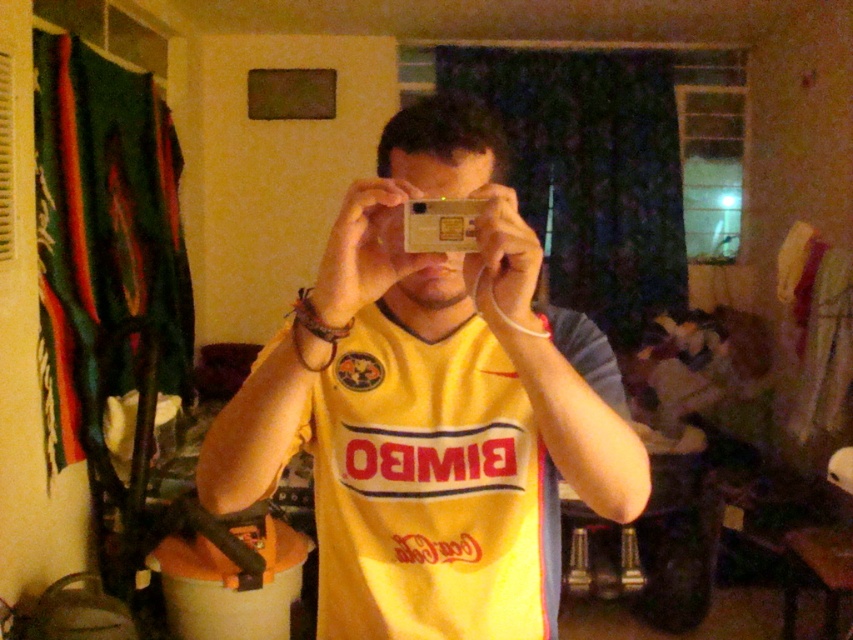
Question: Which object appears closest to the camera in this image?

Choices:
 (A) yellow jersey at center
 (B) metallic gold card at center

Answer: (A)

Question: Can you confirm if yellow jersey at center is positioned to the right of metallic gold card at center?

Choices:
 (A) no
 (B) yes

Answer: (A)

Question: Which of the following is the closest to the observer?

Choices:
 (A) yellow jersey at center
 (B) metallic gold card at center

Answer: (A)

Question: Does yellow jersey at center have a lesser width compared to metallic gold card at center?

Choices:
 (A) yes
 (B) no

Answer: (B)

Question: Is yellow jersey at center to the left of metallic gold card at center from the viewer's perspective?

Choices:
 (A) yes
 (B) no

Answer: (A)

Question: Which object is farther from the camera taking this photo?

Choices:
 (A) yellow jersey at center
 (B) metallic gold card at center

Answer: (B)